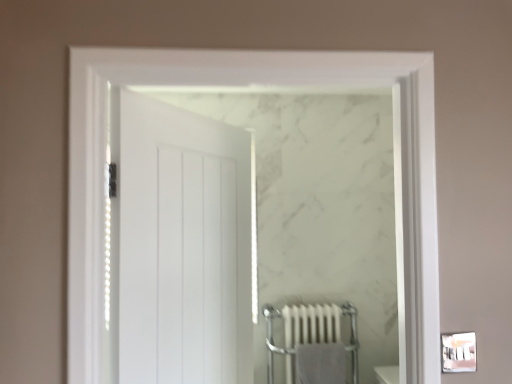
Question: From a real-world perspective, is gray cotton bath towel at lower center physically located above or below white metallic radiator at lower center?

Choices:
 (A) above
 (B) below

Answer: (B)

Question: Visually, is gray cotton bath towel at lower center positioned to the left or to the right of white metallic radiator at lower center?

Choices:
 (A) right
 (B) left

Answer: (A)

Question: Which object is the farthest from the white matte door at center?

Choices:
 (A) white metallic radiator at lower center
 (B) gray cotton bath towel at lower center

Answer: (B)

Question: Which of these objects is positioned farthest from the white metallic radiator at lower center?

Choices:
 (A) gray cotton bath towel at lower center
 (B) white matte door at center

Answer: (B)